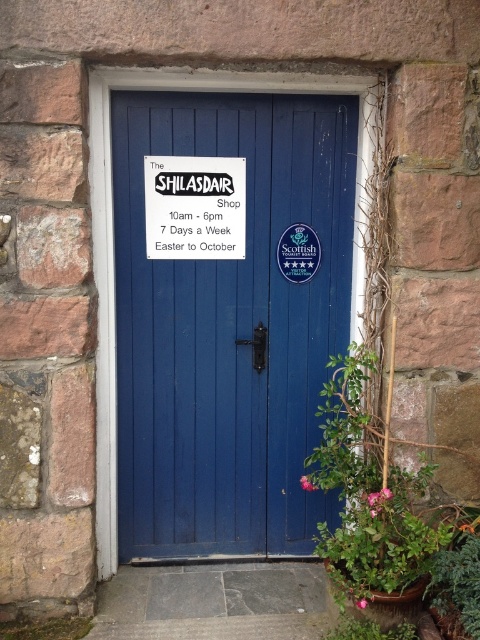
You are standing in front of the blue wooden door at center and want to place a small potted plant next to it. The green leafy plant at right is already there. Where should you place the new plant so it doesn

The blue wooden door at center is above the green leafy plant at right, so placing the new plant below the blue wooden door at center and next to the green leafy plant at right would be appropriate.

Looking at this image, you are a visitor standing in front of the blue wooden door at center and the green leafy plant at lower right. Which object is taller?

The blue wooden door at center is taller than the green leafy plant at lower right.

You are a gardener who needs to move a new plant between the green leafy plant at right and the green leafy plant at lower right. The new plant is 20 centimeters wide. Will there be enough space between them?

The distance between the green leafy plant at right and the green leafy plant at lower right is 22.91 centimeters. Since the new plant is 20 centimeters wide, there will be enough space between them.